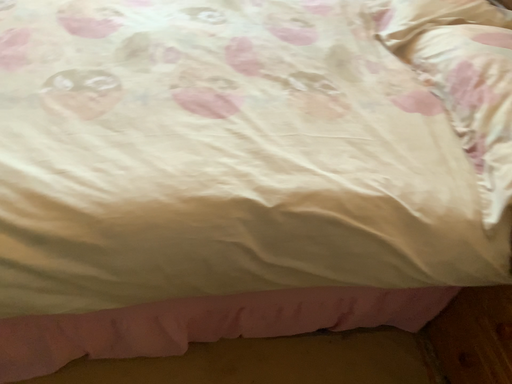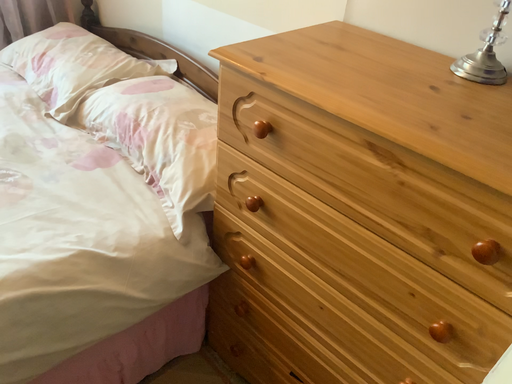
Question: How did the camera likely rotate when shooting the video?

Choices:
 (A) rotated downward
 (B) rotated upward

Answer: (B)